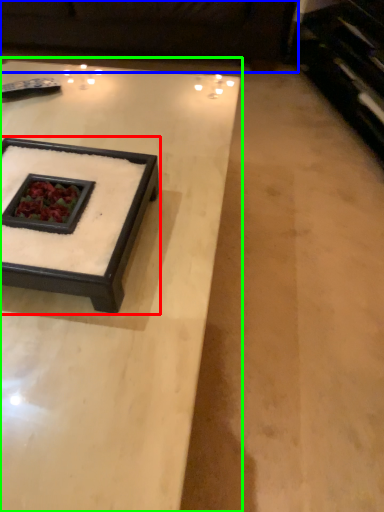
Question: Estimate the real-world distances between objects in this image. Which object is closer to coffee table (highlighted by a red box), couch (highlighted by a blue box) or coffee table (highlighted by a green box)?

Choices:
 (A) couch
 (B) coffee table

Answer: (B)